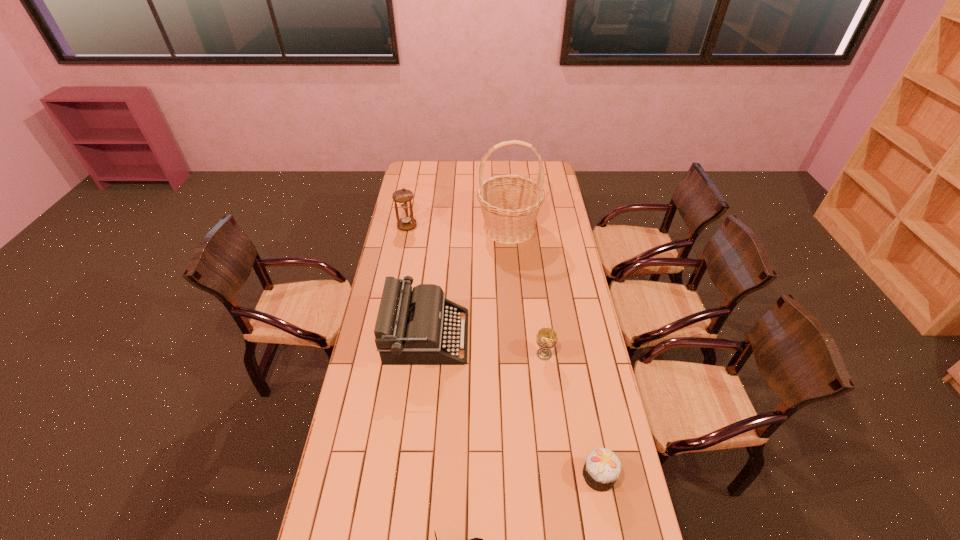
You are a GUI agent. You are given a task and a screenshot of the screen. Output one action in this format:
    pyautogui.click(x=<x>, y=<y>)
    Task: Click on the free spot between the tallest object and the cupcake
    The height and width of the screenshot is (540, 960).
    Given the screenshot: What is the action you would take?
    click(554, 352)

Locate an element on the screen. free space between the chalice and the second nearest object is located at coordinates (571, 415).

Locate an element on the screen. The width and height of the screenshot is (960, 540). blank region between the typewriter and the chalice is located at coordinates (486, 345).

Where is `vacant region between the chalice and the hourglass`? vacant region between the chalice and the hourglass is located at coordinates (475, 290).

Locate an element on the screen. unoccupied area between the hourglass and the tallest object is located at coordinates (458, 227).

Identify which object is the fifth closest to the nearest object. Please provide its 2D coordinates. Your answer should be formatted as a tuple, i.e. [(x, y)], where the tuple contains the x and y coordinates of a point satisfying the conditions above.

[(403, 196)]

At what (x,y) coordinates should I click in order to perform the action: click on object that is the fourth closest to the typewriter. Please return your answer as a coordinate pair (x, y). The width and height of the screenshot is (960, 540). Looking at the image, I should click on (403, 196).

Locate an element on the screen. free location that satisfies the following two spatial constraints: 1. on the typing side of the typewriter; 2. on the right side of the chalice is located at coordinates (425, 354).

Identify the location of free space that satisfies the following two spatial constraints: 1. on the typing side of the typewriter; 2. on the left side of the cupcake. (412, 475).

Image resolution: width=960 pixels, height=540 pixels. Find the location of `free point that satisfies the following two spatial constraints: 1. on the typing side of the chalice; 2. on the right side of the typewriter`. free point that satisfies the following two spatial constraints: 1. on the typing side of the chalice; 2. on the right side of the typewriter is located at coordinates (425, 354).